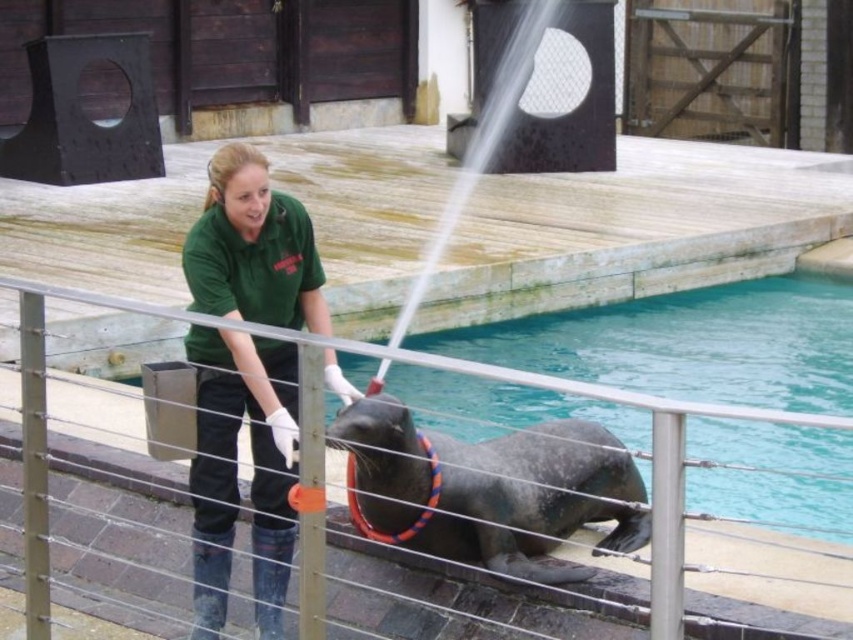
Question: Which object is closer to the camera taking this photo?

Choices:
 (A) gray rubber seal at center
 (B) blue smooth water at lower center
 (C) metal wire rail at center

Answer: (C)

Question: Is blue smooth water at lower center thinner than gray rubber seal at center?

Choices:
 (A) yes
 (B) no

Answer: (A)

Question: Can you confirm if gray rubber seal at center is bigger than metal wire rail at center?

Choices:
 (A) yes
 (B) no

Answer: (A)

Question: Considering the relative positions of blue smooth water at lower center and green uniform at center in the image provided, where is blue smooth water at lower center located with respect to green uniform at center?

Choices:
 (A) below
 (B) above

Answer: (A)

Question: Which object is closer to the camera taking this photo?

Choices:
 (A) blue smooth water at lower center
 (B) metal wire rail at center
 (C) gray rubber seal at center

Answer: (B)

Question: Which point is farther to the camera?

Choices:
 (A) gray rubber seal at center
 (B) blue smooth water at lower center
 (C) green uniform at center
 (D) metal wire rail at center

Answer: (B)